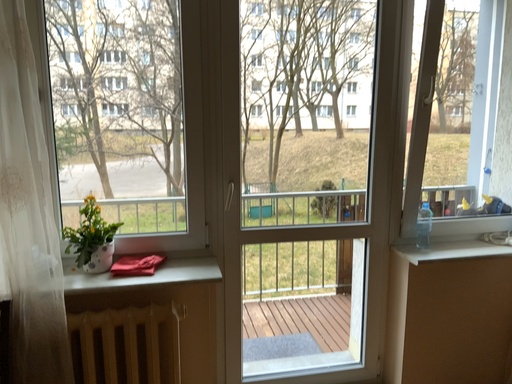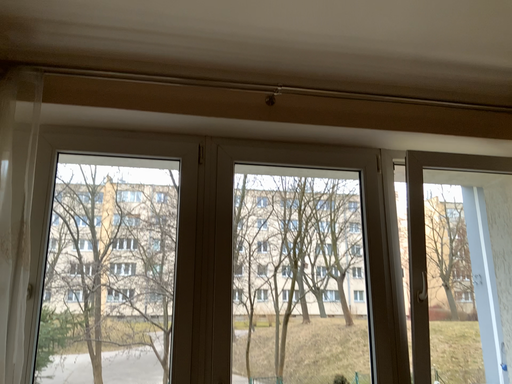
Question: How did the camera likely rotate when shooting the video?

Choices:
 (A) rotated upward
 (B) rotated downward

Answer: (A)